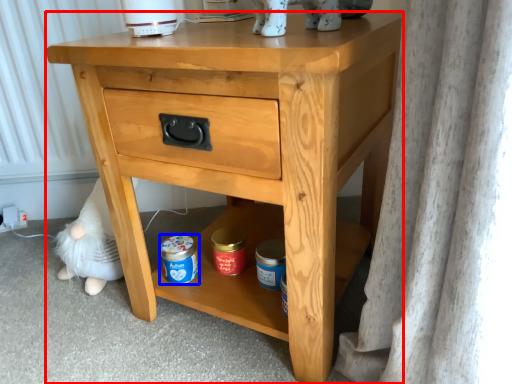
Question: Among these objects, which one is farthest to the camera, nightstand (highlighted by a red box) or glass jar (highlighted by a blue box)?

Choices:
 (A) nightstand
 (B) glass jar

Answer: (B)